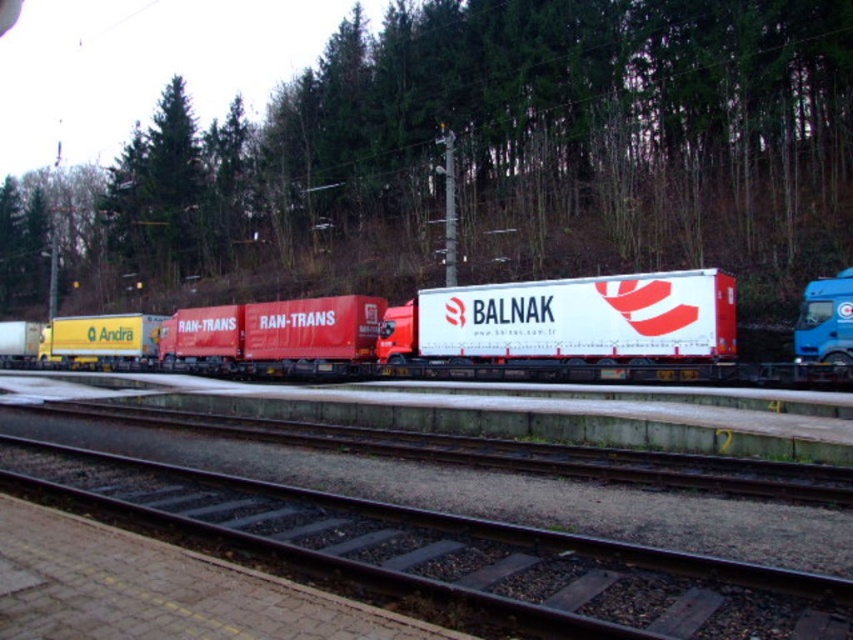
You are standing on the platform at the railway station and see two points marked on the ground. The first point is at coordinate point (757, 362) and the second is at point (329, 550). If you look towards the tracks, which point is farther away from you?

Point (757, 362) is behind point (329, 550), so the first point is farther away from you.

You are a delivery driver who needs to park your truck exactly between the white glossy trailer truck at center and the metal at center. Your truck is 3 meters long. Is there enough space between them to park your truck without overlapping either vehicle?

The distance between the white glossy trailer truck at center and the metal at center is 11.51 meters. Since your truck is only 3 meters long, there is ample space to park it between them without overlapping either vehicle.

Based on the photo, you are a delivery driver who needs to park your truck on the platform. The platform has limited space. You have a white glossy trailer truck at center and a blue metallic truck at right. Which truck would require more space to park?

The white glossy trailer truck at center is bigger than the blue metallic truck at right, so it would require more space to park.